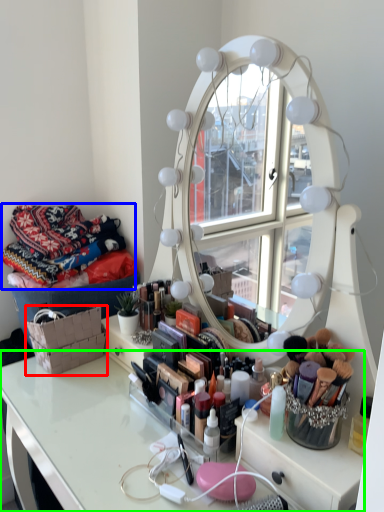
Question: Considering the real-world distances, which object is farthest from basket (highlighted by a red box)? material (highlighted by a blue box) or table (highlighted by a green box)?

Choices:
 (A) material
 (B) table

Answer: (A)